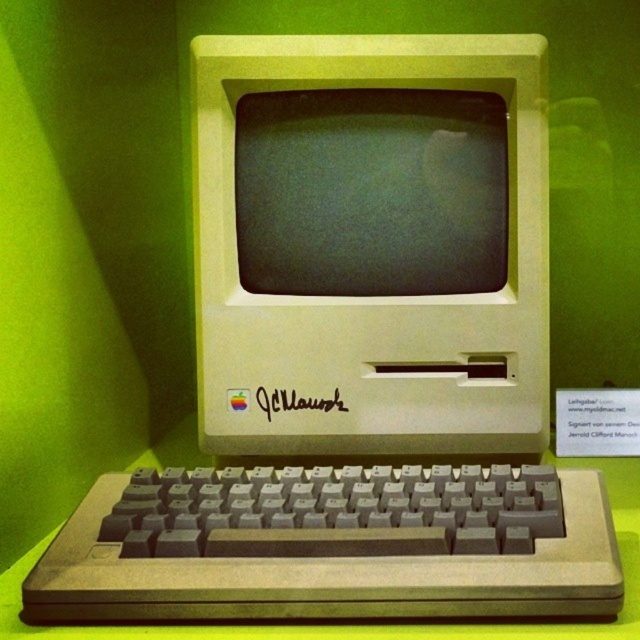
Question: Which point is farther to the camera?

Choices:
 (A) gray plastic keyboard at lower center
 (B) beige plastic monitor at center

Answer: (B)

Question: Estimate the real-world distances between objects in this image. Which object is closer to the black signature at center?

Choices:
 (A) beige plastic monitor at center
 (B) gray plastic keyboard at lower center
 (C) matte plastic screen at center

Answer: (A)

Question: From the image, what is the correct spatial relationship of gray plastic keyboard at lower center in relation to black signature at center?

Choices:
 (A) below
 (B) above

Answer: (A)

Question: Which of the following is the closest to the observer?

Choices:
 (A) (419, 484)
 (B) (508, 193)

Answer: (A)

Question: Is matte plastic screen at center further to camera compared to black signature at center?

Choices:
 (A) yes
 (B) no

Answer: (A)

Question: Is beige plastic monitor at center positioned at the back of matte plastic screen at center?

Choices:
 (A) no
 (B) yes

Answer: (A)